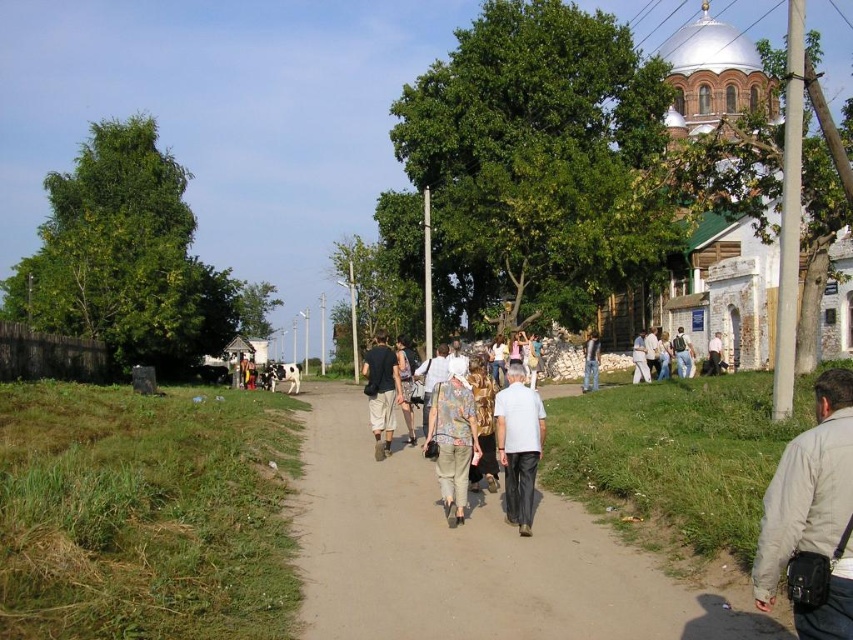
Can you confirm if white stone church at right is positioned below light brown leather jacket at center?

Incorrect, white stone church at right is not positioned below light brown leather jacket at center.

Can you confirm if white stone church at right is positioned to the left of light brown leather jacket at center?

In fact, white stone church at right is to the right of light brown leather jacket at center.

Which is in front, point (824, 333) or point (424, 426)?

Point (424, 426) is in front.

I want to click on white stone church at right, so click(x=729, y=276).

Does dark brown leather pants at center have a smaller size compared to white cotton shirt at center?

No.

Can you confirm if dark brown leather pants at center is positioned to the right of white cotton shirt at center?

In fact, dark brown leather pants at center is to the left of white cotton shirt at center.

Is point (399, 376) farther from viewer compared to point (650, 346)?

No, it is not.

Find the location of a particular element. The height and width of the screenshot is (640, 853). dark brown leather pants at center is located at coordinates (381, 392).

Who is more forward, (440,531) or (524,516)?

Point (524,516) is in front.

Is dirt road at center in front of gray cotton shirt at center?

That is True.

Image resolution: width=853 pixels, height=640 pixels. I want to click on dirt road at center, so click(474, 557).